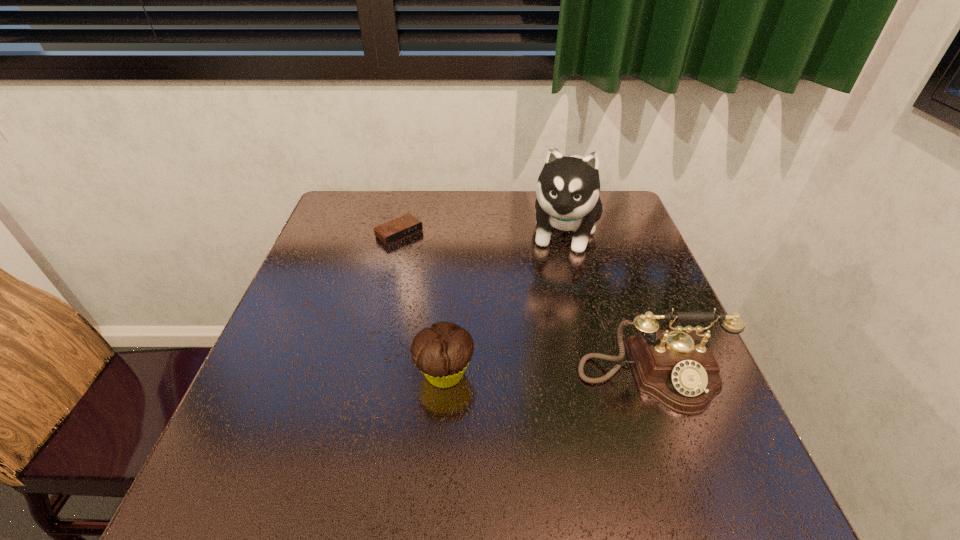
Locate an element on the screen. The width and height of the screenshot is (960, 540). object that stands as the third closest to the shortest object is located at coordinates (676, 367).

At what (x,y) coordinates should I click in order to perform the action: click on object that is the third closest to the puppy. Please return your answer as a coordinate pair (x, y). This screenshot has height=540, width=960. Looking at the image, I should click on (442, 353).